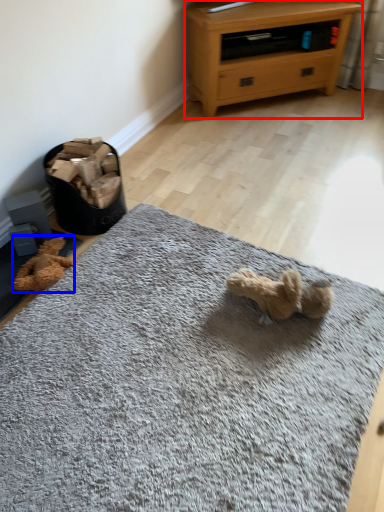
Question: Among these objects, which one is farthest to the camera, chest of drawers (highlighted by a red box) or teddy (highlighted by a blue box)?

Choices:
 (A) chest of drawers
 (B) teddy

Answer: (A)